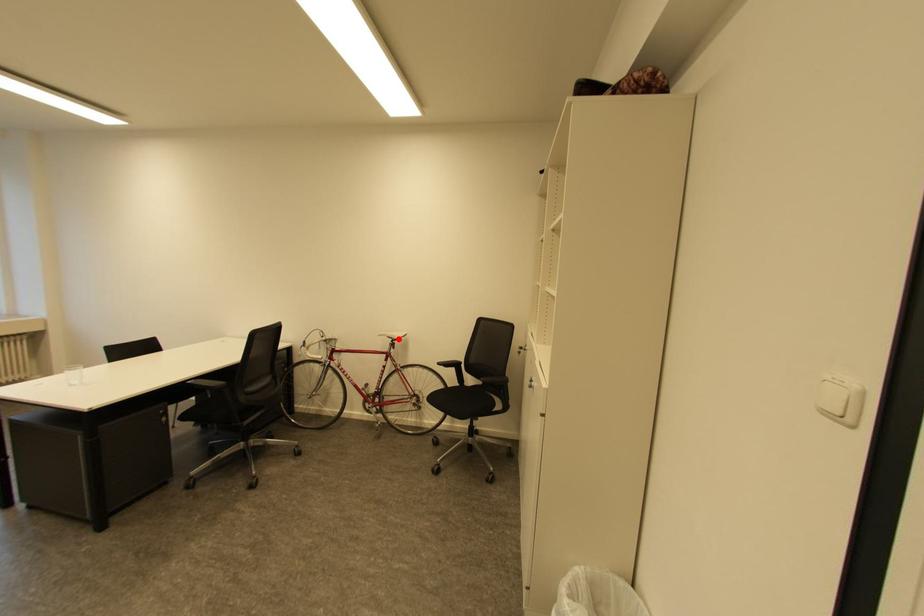
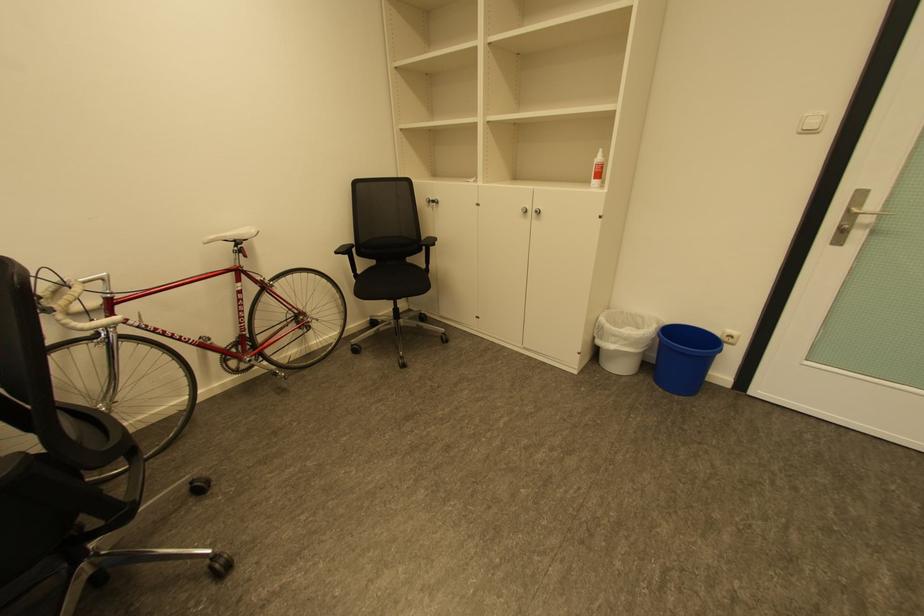
In the second image, find the point that corresponds to the highlighted location in the first image.

(241, 241)